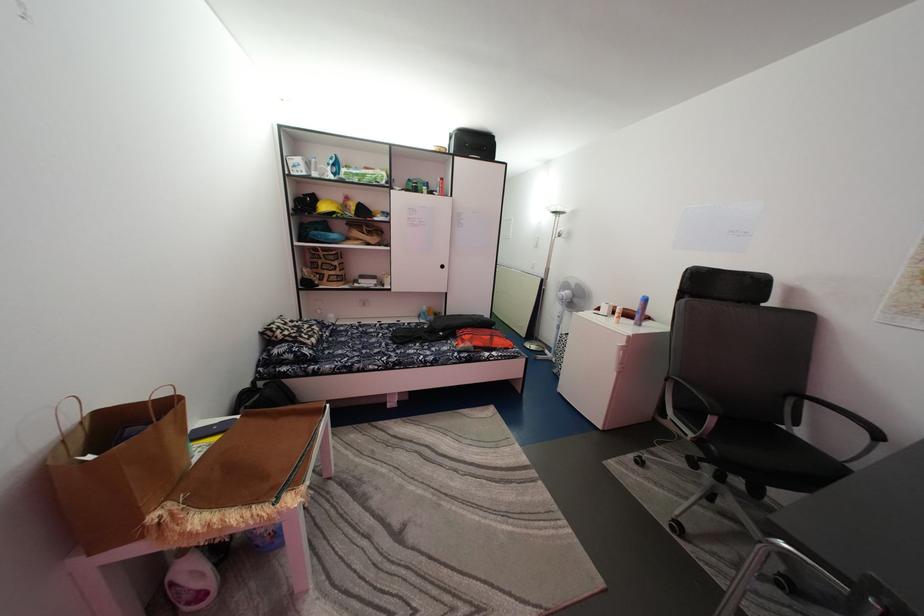
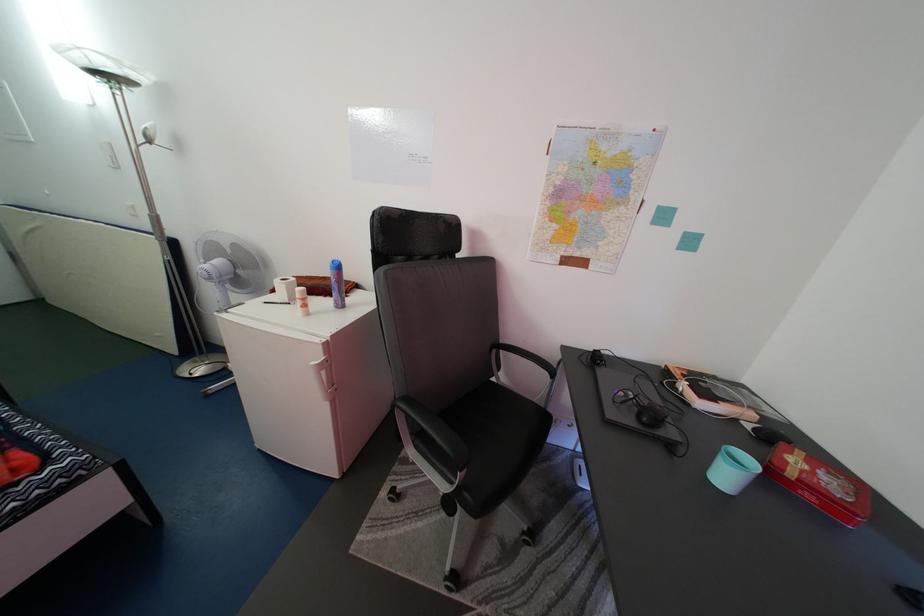
The point at (604,318) is marked in the first image. Where is the corresponding point in the second image?

(280, 304)